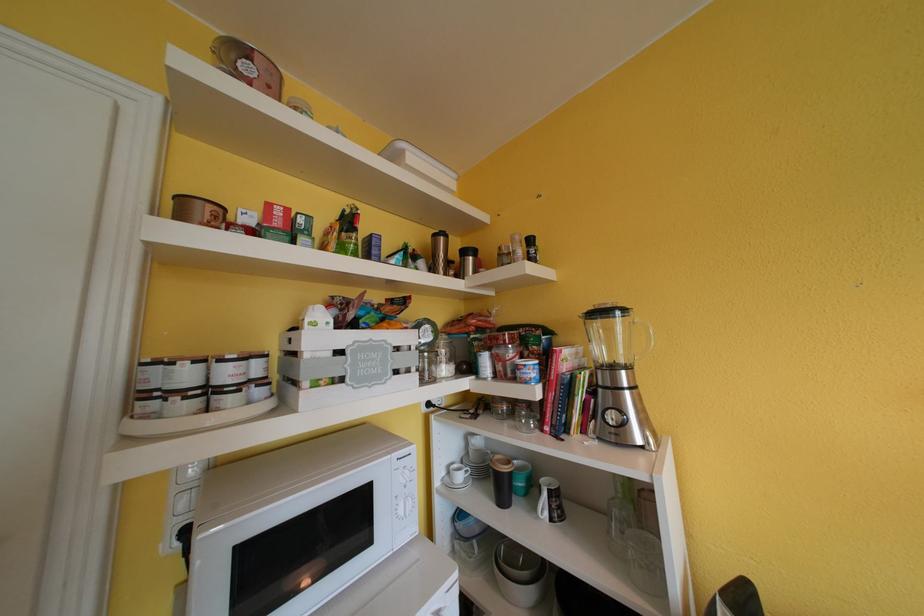
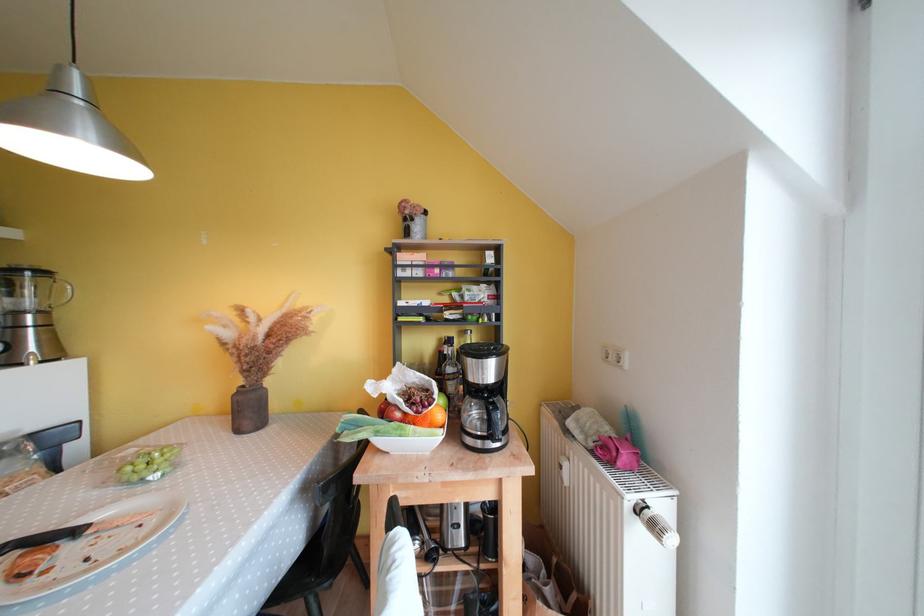
In the second image, find the point that corresponds to point (636, 371) in the first image.

(49, 315)